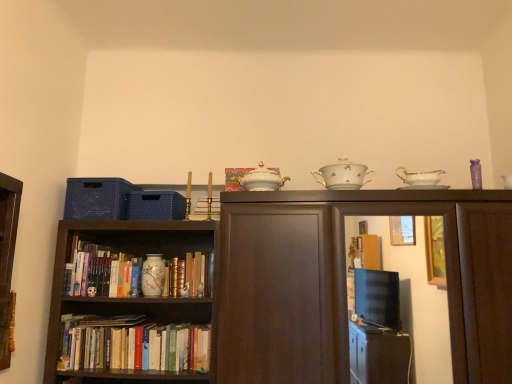
Question: Is matte ceramic book at center, the 2th book in the right-to-left sequence, positioned behind white porcelain sugar bowl at upper center, the second tableware from the back?

Choices:
 (A) yes
 (B) no

Answer: (A)

Question: Is white porcelain sugar bowl at upper center, the second tableware from the back, surrounded by matte ceramic book at center, the second book in the bottom-to-top sequence?

Choices:
 (A) no
 (B) yes

Answer: (A)

Question: From a real-world perspective, is matte ceramic book at center, which is counted as the 2th book, starting from the left, located higher than white porcelain sugar bowl at upper center, which ranks as the second tableware in left-to-right order?

Choices:
 (A) no
 (B) yes

Answer: (A)

Question: Is matte ceramic book at center, which is counted as the 2th book, starting from the left, not within white porcelain sugar bowl at upper center, which ranks as the second tableware in left-to-right order?

Choices:
 (A) yes
 (B) no

Answer: (A)

Question: Can you confirm if matte ceramic book at center, the 2th book in the right-to-left sequence, is thinner than white porcelain sugar bowl at upper center, marked as the second tableware in a bottom-to-top arrangement?

Choices:
 (A) no
 (B) yes

Answer: (B)

Question: In the image, is white porcelain sugar bowl at upper center, the first tableware from the top, positioned in front of or behind matte ceramic book at center, the second book in the bottom-to-top sequence?

Choices:
 (A) behind
 (B) front

Answer: (B)

Question: Considering the positions of point (339, 162) and point (198, 284), is point (339, 162) closer or farther from the camera than point (198, 284)?

Choices:
 (A) farther
 (B) closer

Answer: (B)

Question: From a real-world perspective, is white porcelain sugar bowl at upper center, marked as the second tableware in a bottom-to-top arrangement, above or below matte ceramic book at center, arranged as the 2th book when viewed from the top?

Choices:
 (A) above
 (B) below

Answer: (A)

Question: Would you say white porcelain sugar bowl at upper center, which is the 1th tableware from right to left, is to the left or to the right of matte ceramic book at center, the 2th book in the right-to-left sequence, in the picture?

Choices:
 (A) left
 (B) right

Answer: (B)

Question: From the image's perspective, is porcelain bowl at upper center, which ranks as the third book in back-to-front order, located above or below white porcelain sugar bowl at upper center, the second tableware from the back?

Choices:
 (A) above
 (B) below

Answer: (B)

Question: Is porcelain bowl at upper center, which appears as the 1th book when viewed from the top, in front of or behind white porcelain sugar bowl at upper center, which is the 1th tableware from right to left, in the image?

Choices:
 (A) behind
 (B) front

Answer: (A)

Question: In the image, is porcelain bowl at upper center, acting as the third book starting from the left, on the left side or the right side of white porcelain sugar bowl at upper center, acting as the 1th tableware starting from the front?

Choices:
 (A) right
 (B) left

Answer: (B)

Question: From a real-world perspective, is porcelain bowl at upper center, which is the first book from front to back, above or below white porcelain sugar bowl at upper center, marked as the second tableware in a bottom-to-top arrangement?

Choices:
 (A) below
 (B) above

Answer: (B)

Question: Looking at their shapes, would you say matte dark wood cabinet at center is wider or thinner than porcelain vase at center, which appears as the 1th tableware when ordered from the bottom?

Choices:
 (A) thin
 (B) wide

Answer: (B)

Question: From the image's perspective, is matte dark wood cabinet at center located above or below porcelain vase at center, the first tableware from the left?

Choices:
 (A) below
 (B) above

Answer: (B)